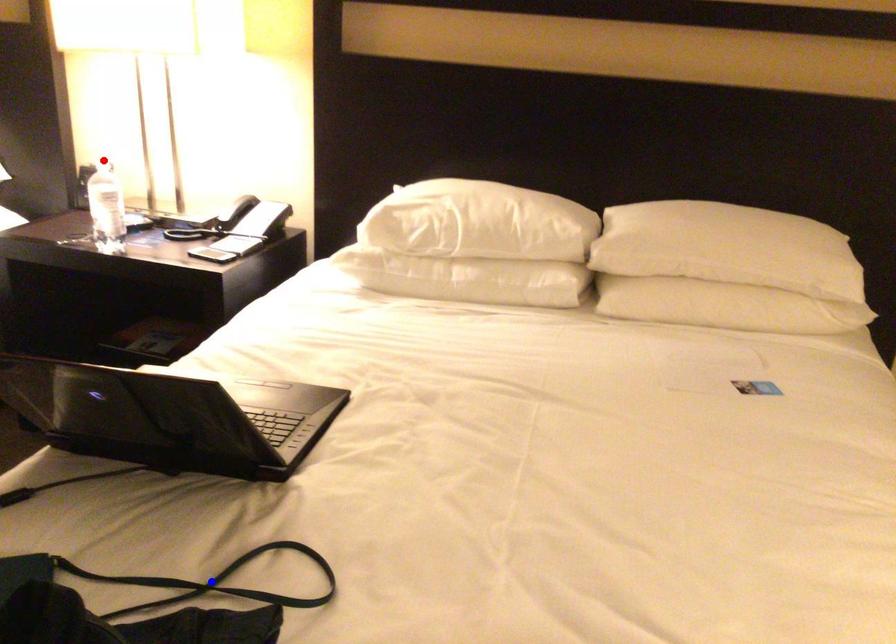
Question: Two points are marked on the image. Which point is closer to the camera?

Choices:
 (A) Blue point is closer.
 (B) Red point is closer.

Answer: (A)